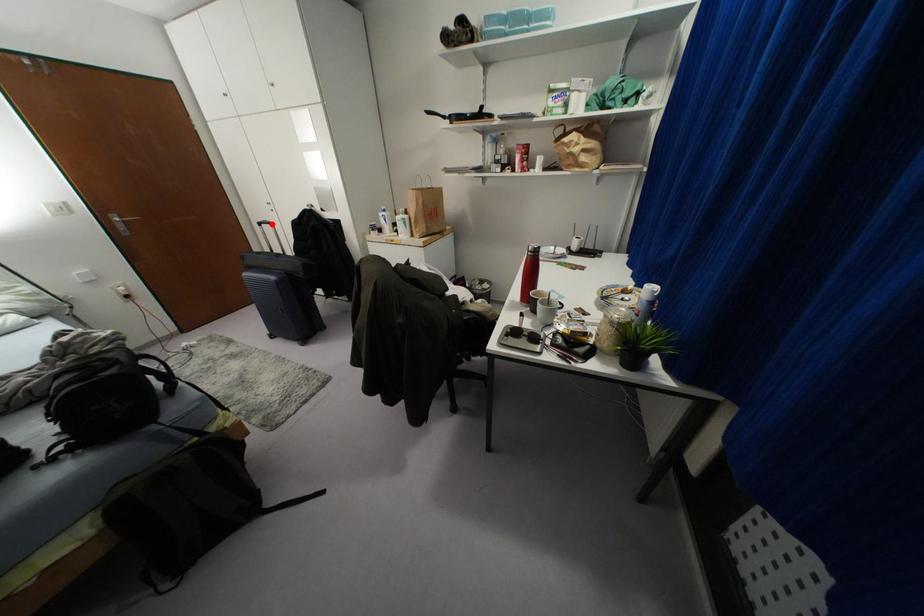
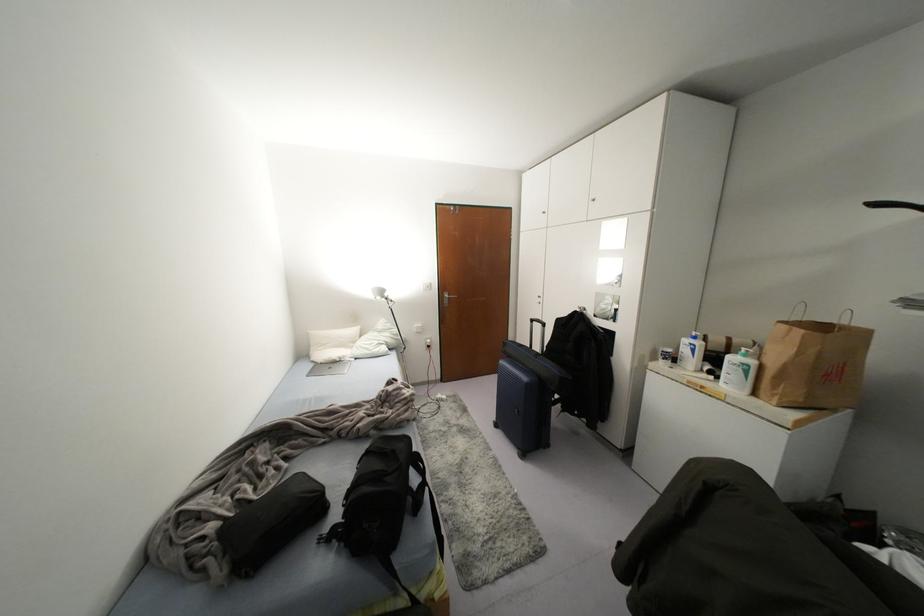
Where in the second image is the point corresponding to the highlighted location from the first image?

(542, 323)